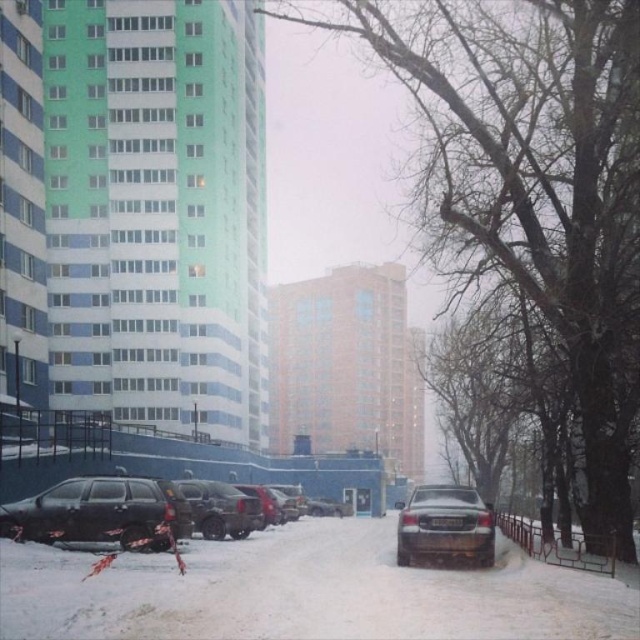
Which is behind, point (209, 532) or point (307, 513)?

Positioned behind is point (307, 513).

Who is more forward, (232, 518) or (314, 509)?

Point (232, 518) is in front.

Is point (205, 502) positioned in front of point (324, 515)?

Yes, it is.

Image resolution: width=640 pixels, height=640 pixels. I want to click on dark brown matte suv at center, so click(220, 508).

Who is more forward, (x=4, y=525) or (x=195, y=525)?

Point (x=4, y=525) is in front.

Is point (40, 525) farther from camera compared to point (241, 499)?

No, (40, 525) is in front of (241, 499).

Image resolution: width=640 pixels, height=640 pixels. I want to click on dark gray matte suv at lower left, so [99, 513].

You are a GUI agent. You are given a task and a screenshot of the screen. Output one action in this format:
    pyautogui.click(x=<x>, y=<y>)
    Task: Click on the dark gray matte suv at lower left
    
    Given the screenshot: What is the action you would take?
    pyautogui.click(x=99, y=513)

Can you confirm if dark gray matte suv at lower left is positioned to the left of dark gray matte truck at center?

Yes, dark gray matte suv at lower left is to the left of dark gray matte truck at center.

Does dark gray matte suv at lower left have a lesser width compared to dark gray matte truck at center?

Incorrect, dark gray matte suv at lower left's width is not less than dark gray matte truck at center's.

This screenshot has width=640, height=640. What are the coordinates of `dark gray matte suv at lower left` in the screenshot? It's located at (99, 513).